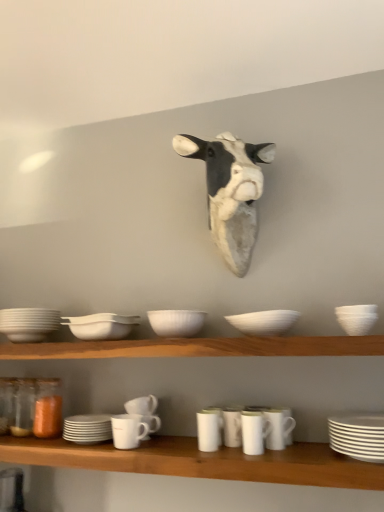
Image resolution: width=384 pixels, height=512 pixels. Find the location of `unoccupied region to the right of white glossy mug at lower center, acting as the ninth tableware starting from the left`. unoccupied region to the right of white glossy mug at lower center, acting as the ninth tableware starting from the left is located at coordinates point(314,450).